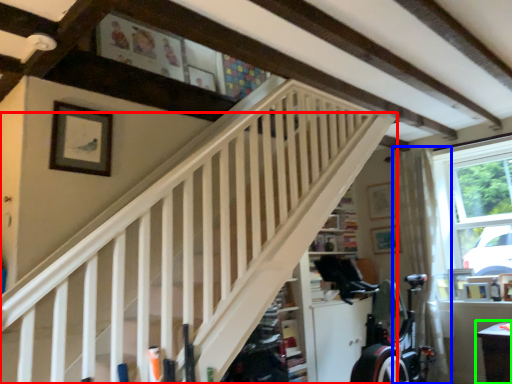
Question: Estimate the real-world distances between objects in this image. Which object is closer to stairs (highlighted by a red box), curtain (highlighted by a blue box) or table (highlighted by a green box)?

Choices:
 (A) curtain
 (B) table

Answer: (B)